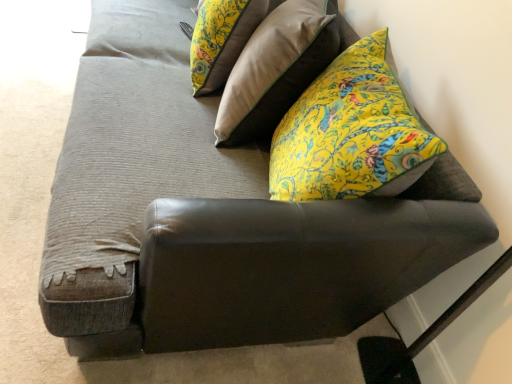
Question: Is point (216, 23) closer or farther from the camera than point (261, 134)?

Choices:
 (A) closer
 (B) farther

Answer: (B)

Question: From a real-world perspective, is floral fabric pillow at upper center, arranged as the 1th pillow when viewed from the left, above or below floral yellow pillow at upper right, arranged as the second pillow when viewed from the left?

Choices:
 (A) below
 (B) above

Answer: (A)

Question: Choose the correct answer: Is floral fabric pillow at upper center, arranged as the 1th pillow when viewed from the left, inside floral yellow pillow at upper right, placed as the first pillow when sorted from right to left, or outside it?

Choices:
 (A) inside
 (B) outside

Answer: (B)

Question: In terms of height, does floral yellow pillow at upper right, arranged as the second pillow when viewed from the left, look taller or shorter compared to floral fabric pillow at upper center, arranged as the 1th pillow when viewed from the left?

Choices:
 (A) short
 (B) tall

Answer: (B)

Question: In terms of width, does floral yellow pillow at upper right, arranged as the second pillow when viewed from the left, look wider or thinner when compared to floral fabric pillow at upper center, arranged as the 1th pillow when viewed from the left?

Choices:
 (A) wide
 (B) thin

Answer: (A)

Question: Would you say floral yellow pillow at upper right, placed as the first pillow when sorted from right to left, is inside or outside floral fabric pillow at upper center, which is counted as the 2th pillow, starting from the right?

Choices:
 (A) outside
 (B) inside

Answer: (A)

Question: From a real-world perspective, is floral yellow pillow at upper right, arranged as the second pillow when viewed from the left, physically located above or below floral fabric pillow at upper center, which is counted as the 2th pillow, starting from the right?

Choices:
 (A) above
 (B) below

Answer: (A)